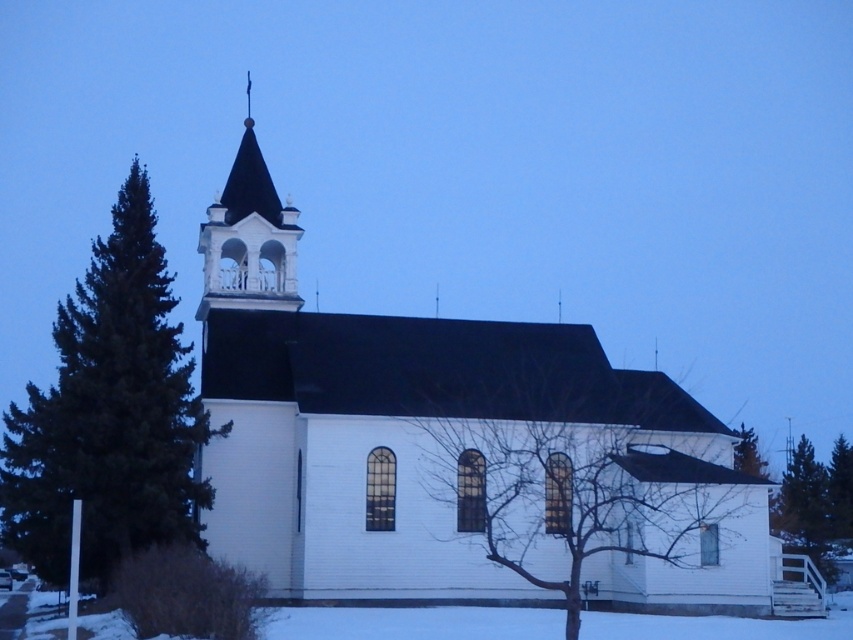
You are an artist sketching the winter scene. You want to ensure the proportions between the bare branches at center and the white wood spire at upper center are accurate. Which object should you draw smaller to maintain the correct scale?

The bare branches at center should be drawn smaller since they occupy less space than the white wood spire at upper center according to the description.

You are standing in front of the white church with a black roof and want to take a photo that includes both the green coniferous tree at left and the white wood spire at upper center. Based on their positions, which object is closer to the left edge of your camera frame?

The green coniferous tree at left is positioned on the left side of white wood spire at upper center, so it will be closer to the left edge of the camera frame.

You are standing in front of the church and notice the bare branches at center and the white wood spire at upper center. Which object is nearer to you?

The bare branches at center are closer to the viewer than the white wood spire at upper center.